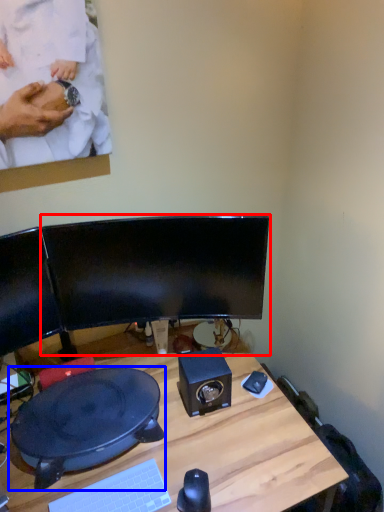
Question: Which of the following is the closest to the observer, computer monitor (highlighted by a red box) or sit (highlighted by a blue box)?

Choices:
 (A) computer monitor
 (B) sit

Answer: (B)